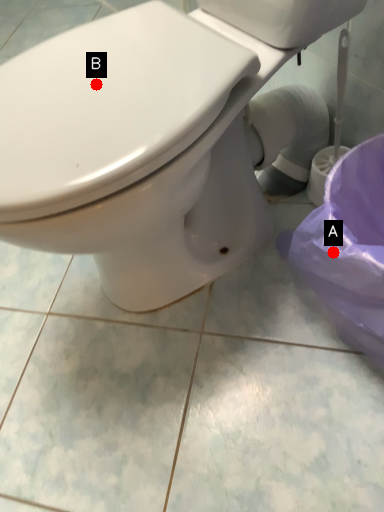
Question: Two points are circled on the image, labeled by A and B beside each circle. Among these points, which one is farthest from the camera?

Choices:
 (A) A is further
 (B) B is further

Answer: (A)